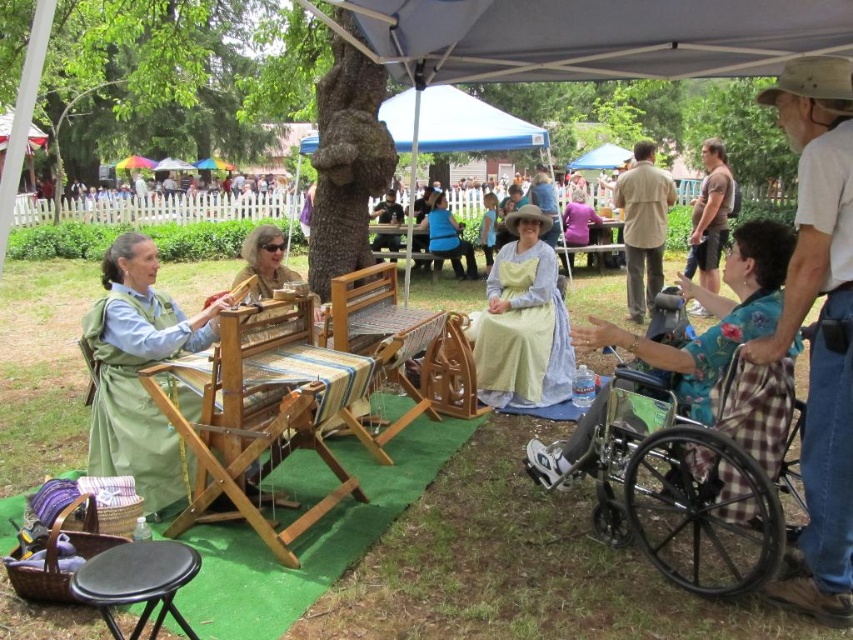
Is black plastic wheelchair at lower right positioned before light blue cotton dress at center?

Yes.

In the scene shown: Does black plastic wheelchair at lower right have a lesser height compared to light blue cotton dress at center?

Indeed, black plastic wheelchair at lower right has a lesser height compared to light blue cotton dress at center.

Find the location of a particular element. black plastic wheelchair at lower right is located at coordinates (688, 458).

This screenshot has width=853, height=640. I want to click on black plastic wheelchair at lower right, so click(688, 458).

Which is more to the left, green cotton apron at left or matte brown hair at center?

green cotton apron at left

Does point (102, 397) lie in front of point (277, 253)?

Yes, it is in front of point (277, 253).

Is point (146, 506) farther from viewer compared to point (231, 284)?

No, (146, 506) is in front of (231, 284).

I want to click on green cotton apron at left, so click(136, 371).

Is brown cotton shirt at upper right below matte brown hair at center?

No.

Does brown cotton shirt at upper right have a lesser width compared to matte brown hair at center?

Yes.

Does point (695, 221) come in front of point (239, 280)?

No, it is behind (239, 280).

The height and width of the screenshot is (640, 853). What are the coordinates of `brown cotton shirt at upper right` in the screenshot? It's located at click(x=711, y=216).